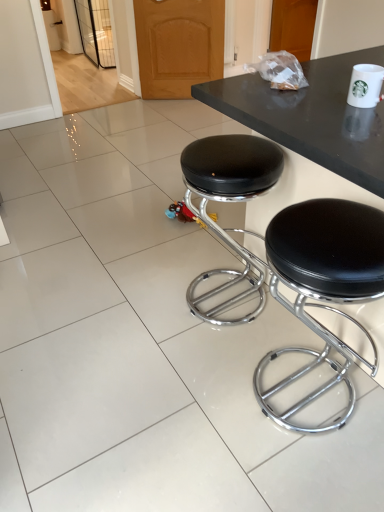
What is the approximate width of black leather stool at center, acting as the second stool starting from the right?

It is 15.80 inches.

This screenshot has height=512, width=384. What are the coordinates of `white ceramic mug at upper right` in the screenshot? It's located at pos(365,85).

Where is `black leather stool at center, placed as the 1th stool when sorted from left to right`? The height and width of the screenshot is (512, 384). black leather stool at center, placed as the 1th stool when sorted from left to right is located at coordinates (229, 201).

From the image's perspective, is white ceramic mug at upper right on black leather stool at center, which is the first stool from right to left?

Indeed, from the image's perspective, white ceramic mug at upper right is shown above black leather stool at center, which is the first stool from right to left.

Considering the relative sizes of white ceramic mug at upper right and black leather stool at center, positioned as the second stool in left-to-right order, in the image provided, is white ceramic mug at upper right bigger than black leather stool at center, positioned as the second stool in left-to-right order,?

Actually, white ceramic mug at upper right might be smaller than black leather stool at center, positioned as the second stool in left-to-right order.

Is white ceramic mug at upper right looking in the opposite direction of black leather stool at center, which is the first stool from right to left?

white ceramic mug at upper right is not turned away from black leather stool at center, which is the first stool from right to left.

Is white ceramic mug at upper right completely or partially outside of black leather stool at center, positioned as the second stool in left-to-right order?

Yes.

Considering the relative sizes of white ceramic mug at upper right and black leather stool at center, acting as the second stool starting from the right, in the image provided, is white ceramic mug at upper right wider than black leather stool at center, acting as the second stool starting from the right,?

Incorrect, the width of white ceramic mug at upper right does not surpass that of black leather stool at center, acting as the second stool starting from the right.

Identify the location of paper cup above the black leather stool at center, acting as the second stool starting from the right (from a real-world perspective). (365, 85).

Between white ceramic mug at upper right and black leather stool at center, placed as the 1th stool when sorted from left to right, which one is positioned behind?

black leather stool at center, placed as the 1th stool when sorted from left to right, is more distant.

From the picture: Can you tell me how much white ceramic mug at upper right and black leather stool at center, placed as the 1th stool when sorted from left to right, differ in facing direction?

The angular difference between white ceramic mug at upper right and black leather stool at center, placed as the 1th stool when sorted from left to right, is 91.2 degrees.

From a real-world perspective, is black leather stool at center, positioned as the second stool in left-to-right order, positioned above or below white ceramic mug at upper right?

black leather stool at center, positioned as the second stool in left-to-right order, is situated lower than white ceramic mug at upper right in the real world.

From the image's perspective, between black leather stool at center, which is the first stool from right to left, and white ceramic mug at upper right, who is located below?

black leather stool at center, which is the first stool from right to left, from the image's perspective.

Visually, is black leather stool at center, positioned as the second stool in left-to-right order, positioned to the left or to the right of white ceramic mug at upper right?

black leather stool at center, positioned as the second stool in left-to-right order, is positioned on white ceramic mug at upper right's left side.

Does black leather stool at center, positioned as the second stool in left-to-right order, contain white ceramic mug at upper right?

Definitely not — white ceramic mug at upper right is not inside black leather stool at center, positioned as the second stool in left-to-right order.

Based on the photo, does black leather stool at center, positioned as the second stool in left-to-right order, appear on the right side of black leather stool at center, placed as the 1th stool when sorted from left to right?

Indeed, black leather stool at center, positioned as the second stool in left-to-right order, is positioned on the right side of black leather stool at center, placed as the 1th stool when sorted from left to right.

Which is behind, point (313, 240) or point (244, 252)?

Positioned behind is point (244, 252).

From a real-world perspective, is black leather stool at center, which is the first stool from right to left, under black leather stool at center, acting as the second stool starting from the right?

Actually, black leather stool at center, which is the first stool from right to left, is physically above black leather stool at center, acting as the second stool starting from the right, in the real world.

Do you think black leather stool at center, positioned as the second stool in left-to-right order, is within black leather stool at center, placed as the 1th stool when sorted from left to right, or outside of it?

black leather stool at center, positioned as the second stool in left-to-right order, is located beyond the bounds of black leather stool at center, placed as the 1th stool when sorted from left to right.

Is black leather stool at center, acting as the second stool starting from the right, with white ceramic mug at upper right?

No, black leather stool at center, acting as the second stool starting from the right, is not with white ceramic mug at upper right.

From the image's perspective, is black leather stool at center, acting as the second stool starting from the right, on top of white ceramic mug at upper right?

Actually, black leather stool at center, acting as the second stool starting from the right, appears below white ceramic mug at upper right in the image.

The height and width of the screenshot is (512, 384). Find the location of `stool that appears behind the white ceramic mug at upper right`. stool that appears behind the white ceramic mug at upper right is located at coordinates (229, 201).

Is black leather stool at center, placed as the 1th stool when sorted from left to right, spatially inside white ceramic mug at upper right, or outside of it?

black leather stool at center, placed as the 1th stool when sorted from left to right, lies outside white ceramic mug at upper right.

Looking at this image, from a real-world perspective, which object rests below the other?

black leather stool at center, acting as the second stool starting from the right, from a real-world perspective.

Is black leather stool at center, acting as the second stool starting from the right, located outside black leather stool at center, positioned as the second stool in left-to-right order?

black leather stool at center, acting as the second stool starting from the right, is positioned outside black leather stool at center, positioned as the second stool in left-to-right order.

Which object is closer to the camera taking this photo, black leather stool at center, acting as the second stool starting from the right, or black leather stool at center, which is the first stool from right to left?

black leather stool at center, which is the first stool from right to left, is more forward.

This screenshot has height=512, width=384. In order to click on paper cup positioned vertically above the black leather stool at center, which is the first stool from right to left (from a real-world perspective) in this screenshot , I will do `click(365, 85)`.

You are a GUI agent. You are given a task and a screenshot of the screen. Output one action in this format:
    pyautogui.click(x=<x>, y=<y>)
    Task: Click on the 2nd stool to the left of the white ceramic mug at upper right, counting from the anchor's position
    The width and height of the screenshot is (384, 512).
    Given the screenshot: What is the action you would take?
    pyautogui.click(x=229, y=201)

Considering their positions, is black leather stool at center, acting as the second stool starting from the right, positioned closer to black leather stool at center, which is the first stool from right to left, than white ceramic mug at upper right?

black leather stool at center, acting as the second stool starting from the right, is closer to black leather stool at center, which is the first stool from right to left.

When comparing their distances from black leather stool at center, placed as the 1th stool when sorted from left to right, does black leather stool at center, which is the first stool from right to left, or white ceramic mug at upper right seem further?

Among the two, white ceramic mug at upper right is located further to black leather stool at center, placed as the 1th stool when sorted from left to right.

When comparing their distances from white ceramic mug at upper right, does black leather stool at center, placed as the 1th stool when sorted from left to right, or black leather stool at center, which is the first stool from right to left, seem closer?

Among the two, black leather stool at center, which is the first stool from right to left, is located nearer to white ceramic mug at upper right.

Looking at the image, which one is located further to white ceramic mug at upper right, black leather stool at center, positioned as the second stool in left-to-right order, or black leather stool at center, acting as the second stool starting from the right?

Among the two, black leather stool at center, acting as the second stool starting from the right, is located further to white ceramic mug at upper right.

Which object lies nearer to the anchor point black leather stool at center, placed as the 1th stool when sorted from left to right, white ceramic mug at upper right or black leather stool at center, which is the first stool from right to left?

black leather stool at center, which is the first stool from right to left, is closer to black leather stool at center, placed as the 1th stool when sorted from left to right.

Considering their positions, is white ceramic mug at upper right positioned further to black leather stool at center, positioned as the second stool in left-to-right order, than black leather stool at center, acting as the second stool starting from the right?

→ Based on the image, white ceramic mug at upper right appears to be further to black leather stool at center, positioned as the second stool in left-to-right order.

What are the coordinates of `stool between white ceramic mug at upper right and black leather stool at center, positioned as the second stool in left-to-right order, from top to bottom` in the screenshot? It's located at (229, 201).